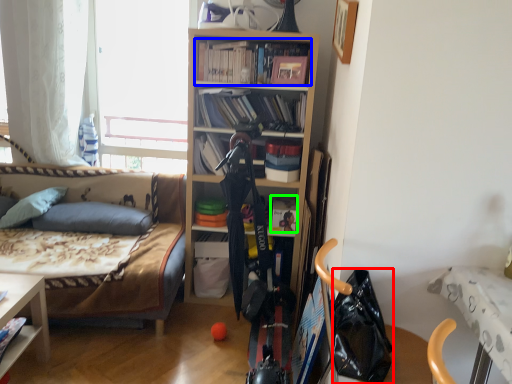
Question: Which object is positioned farthest from handbag (highlighted by a red box)? Select from book (highlighted by a blue box) and book (highlighted by a green box).

Choices:
 (A) book
 (B) book

Answer: (A)